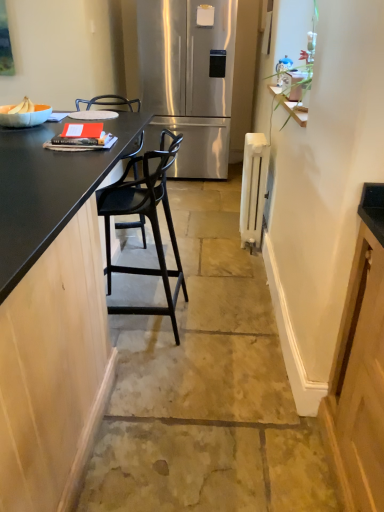
The width and height of the screenshot is (384, 512). Find the location of `vacant space that's between white painted metal radiator at right and black matte bar stool at center`. vacant space that's between white painted metal radiator at right and black matte bar stool at center is located at coordinates (212, 271).